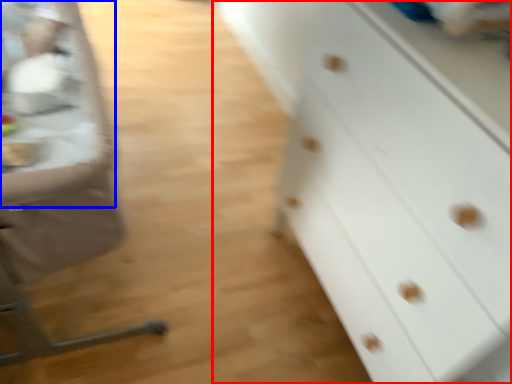
Question: Which of the following is the closest to the observer, chest of drawers (highlighted by a red box) or table (highlighted by a blue box)?

Choices:
 (A) chest of drawers
 (B) table

Answer: (A)